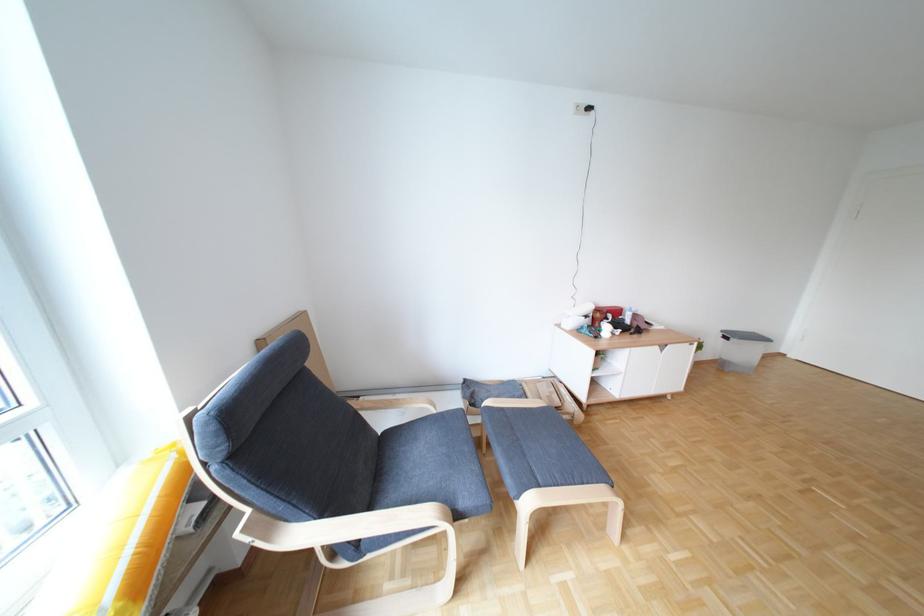
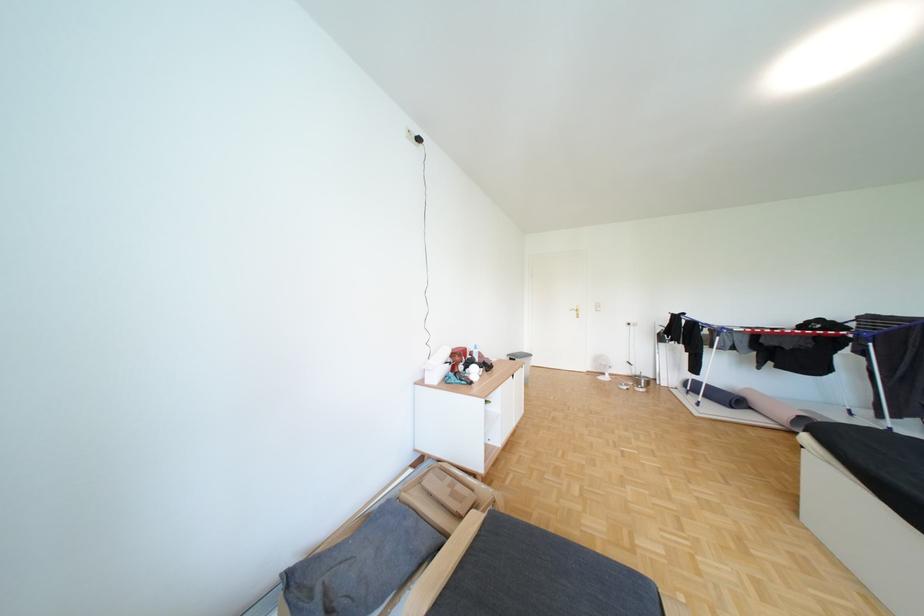
Question: How did the camera likely rotate?

Choices:
 (A) Left
 (B) Right
 (C) Up
 (D) Down

Answer: (B)